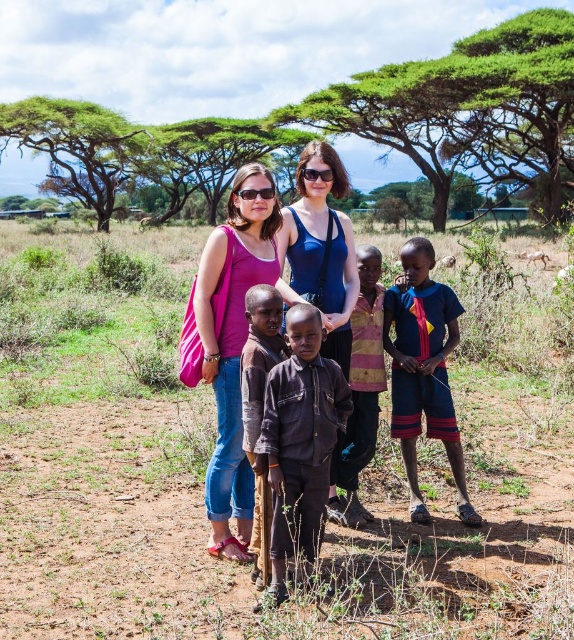
Does pink fabric bag at center have a greater height compared to dark brown leather jacket at center?

Correct, pink fabric bag at center is much taller as dark brown leather jacket at center.

Does point (340, 310) lie behind point (287, 506)?

Yes, point (340, 310) is behind point (287, 506).

This screenshot has height=640, width=574. What do you see at coordinates (305, 240) in the screenshot?
I see `pink fabric bag at center` at bounding box center [305, 240].

Locate an element on the screen. pink fabric bag at center is located at coordinates tap(305, 240).

Is pink fabric at center above blue cotton shorts at lower right?

Yes.

Does point (235, 403) come closer to viewer compared to point (413, 454)?

Yes, point (235, 403) is in front of point (413, 454).

The image size is (574, 640). Find the location of `pink fabric at center`. pink fabric at center is located at coordinates (230, 344).

Does blue cotton shorts at lower right appear under brown cotton shirt at center?

Incorrect, blue cotton shorts at lower right is not positioned below brown cotton shirt at center.

Does point (432, 380) lie in front of point (259, 472)?

No, (432, 380) is behind (259, 472).

Who is more distant from viewer, (405, 380) or (251, 545)?

Positioned behind is point (405, 380).

Locate an element on the screen. The image size is (574, 640). blue cotton shorts at lower right is located at coordinates (424, 369).